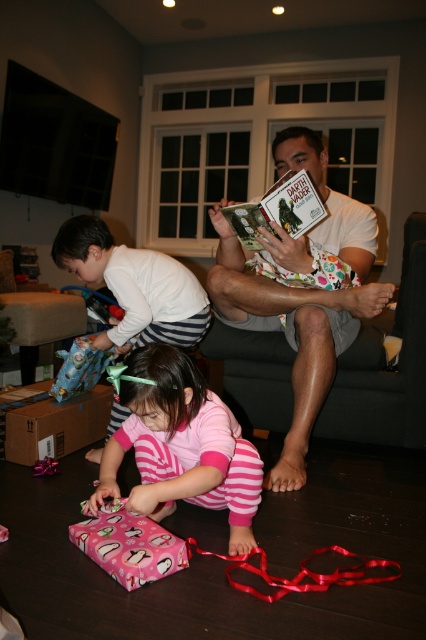
Which of these two, pink striped pajamas at lower center or hardcover book at center, stands shorter?

hardcover book at center

Who is more forward, [126,429] or [265,209]?

Point [126,429] is more forward.

The height and width of the screenshot is (640, 426). What are the coordinates of `pink striped pajamas at lower center` in the screenshot? It's located at coord(181,445).

Can you confirm if white striped pants at left is positioned above pink glossy wrapping paper at lower left?

Yes, white striped pants at left is above pink glossy wrapping paper at lower left.

Describe the element at coordinates (135, 285) in the screenshot. I see `white striped pants at left` at that location.

Between point (112, 403) and point (104, 556), which one is positioned in front?

Point (104, 556)

This screenshot has height=640, width=426. I want to click on white striped pants at left, so click(135, 285).

Is white dotted shorts at center positioned at the back of white striped pants at left?

No, it is in front of white striped pants at left.

Identify the location of white dotted shorts at center. (301, 291).

You are a GUI agent. You are given a task and a screenshot of the screen. Output one action in this format:
    pyautogui.click(x=<x>, y=<y>)
    Task: Click on the white dotted shorts at center
    
    Given the screenshot: What is the action you would take?
    pyautogui.click(x=301, y=291)